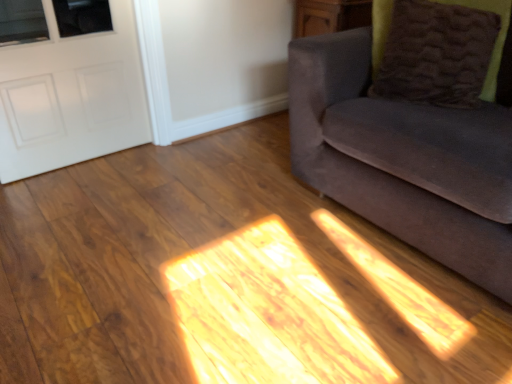
Question: From the image's perspective, is brown fuzzy pillow at upper right located above velvet gray couch at right?

Choices:
 (A) yes
 (B) no

Answer: (A)

Question: Can you confirm if brown fuzzy pillow at upper right is taller than velvet gray couch at right?

Choices:
 (A) no
 (B) yes

Answer: (A)

Question: From the image's perspective, is brown fuzzy pillow at upper right beneath velvet gray couch at right?

Choices:
 (A) no
 (B) yes

Answer: (A)

Question: Is velvet gray couch at right inside brown fuzzy pillow at upper right?

Choices:
 (A) yes
 (B) no

Answer: (B)

Question: Is brown fuzzy pillow at upper right oriented away from velvet gray couch at right?

Choices:
 (A) no
 (B) yes

Answer: (B)

Question: Would you say velvet gray couch at right is to the left or to the right of brown fuzzy pillow at upper right in the picture?

Choices:
 (A) left
 (B) right

Answer: (B)

Question: Looking at their shapes, would you say velvet gray couch at right is wider or thinner than brown fuzzy pillow at upper right?

Choices:
 (A) thin
 (B) wide

Answer: (B)

Question: From their relative heights in the image, would you say velvet gray couch at right is taller or shorter than brown fuzzy pillow at upper right?

Choices:
 (A) short
 (B) tall

Answer: (B)

Question: From the image's perspective, is velvet gray couch at right positioned above or below brown fuzzy pillow at upper right?

Choices:
 (A) below
 (B) above

Answer: (A)

Question: Considering their positions, is brown fuzzy pillow at upper right located in front of or behind white matte door at left?

Choices:
 (A) front
 (B) behind

Answer: (A)

Question: Considering the positions of brown fuzzy pillow at upper right and white matte door at left in the image, is brown fuzzy pillow at upper right taller or shorter than white matte door at left?

Choices:
 (A) short
 (B) tall

Answer: (A)

Question: Is brown fuzzy pillow at upper right situated inside white matte door at left or outside?

Choices:
 (A) inside
 (B) outside

Answer: (B)

Question: From the image's perspective, is brown fuzzy pillow at upper right located above or below white matte door at left?

Choices:
 (A) below
 (B) above

Answer: (B)

Question: In terms of size, does white matte door at left appear bigger or smaller than brown fuzzy pillow at upper right?

Choices:
 (A) big
 (B) small

Answer: (A)

Question: Is white matte door at left inside the boundaries of brown fuzzy pillow at upper right, or outside?

Choices:
 (A) outside
 (B) inside

Answer: (A)